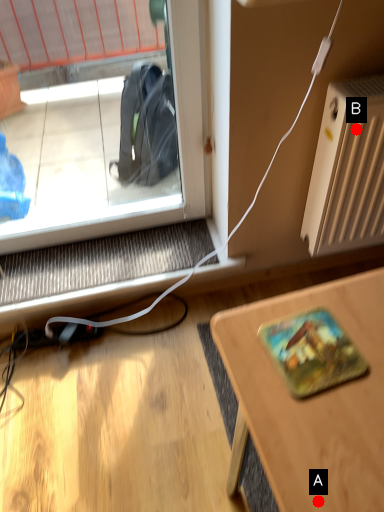
Question: Two points are circled on the image, labeled by A and B beside each circle. Which point is closer to the camera taking this photo?

Choices:
 (A) A is closer
 (B) B is closer

Answer: (A)